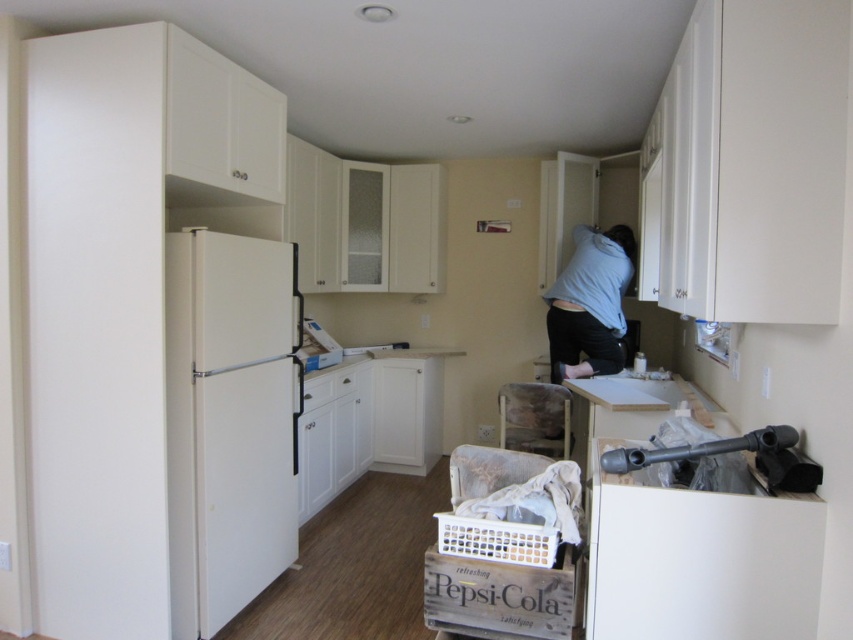
Question: Which is farther from the white plastic crate at lower center?

Choices:
 (A) blue cotton shirt at upper center
 (B) white matte refrigerator at left

Answer: (A)

Question: Is white matte refrigerator at left below white plastic crate at lower center?

Choices:
 (A) no
 (B) yes

Answer: (A)

Question: From the image, what is the correct spatial relationship of white matte refrigerator at left in relation to white plastic crate at lower center?

Choices:
 (A) above
 (B) below

Answer: (A)

Question: Among these objects, which one is farthest from the camera?

Choices:
 (A) white matte refrigerator at left
 (B) blue cotton shirt at upper center
 (C) white plastic crate at lower center

Answer: (B)

Question: Is blue cotton shirt at upper center closer to camera compared to white plastic crate at lower center?

Choices:
 (A) no
 (B) yes

Answer: (A)

Question: Which point is closer to the camera taking this photo?

Choices:
 (A) (517, 556)
 (B) (251, 307)
 (C) (561, 275)

Answer: (A)